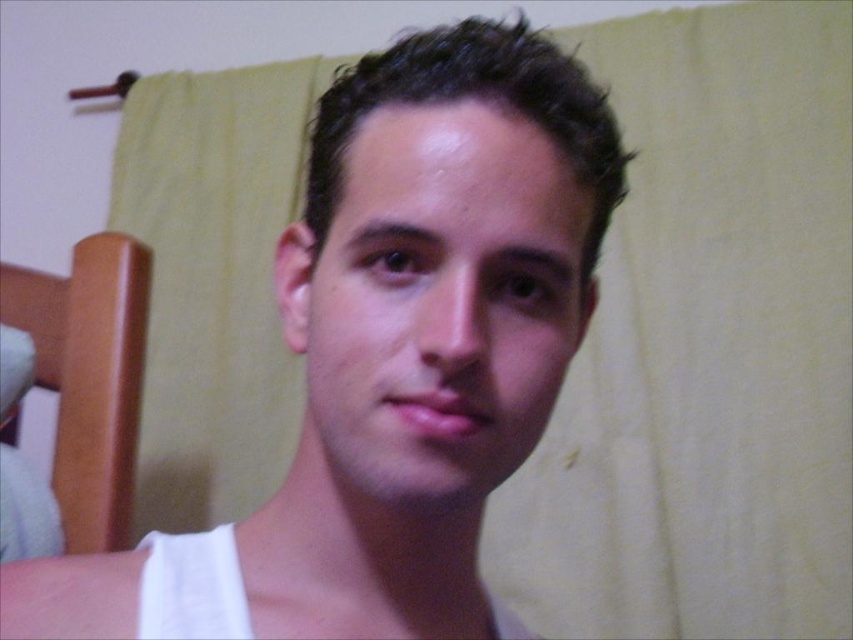
Question: Can you confirm if white matte tank top at center is positioned above smooth skin face at center?

Choices:
 (A) yes
 (B) no

Answer: (B)

Question: Is white matte tank top at center thinner than smooth skin face at center?

Choices:
 (A) yes
 (B) no

Answer: (B)

Question: Which point appears farthest from the camera in this image?

Choices:
 (A) (386, 180)
 (B) (416, 355)

Answer: (A)

Question: Can you confirm if white matte tank top at center is positioned to the right of smooth skin face at center?

Choices:
 (A) yes
 (B) no

Answer: (B)